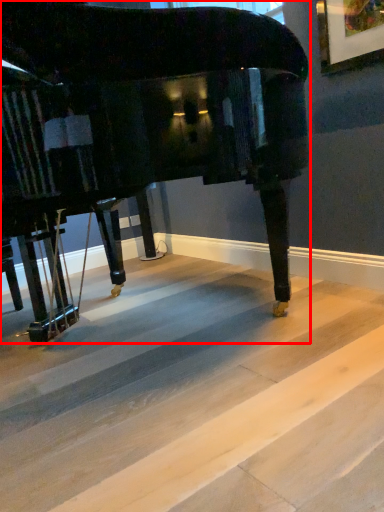
Question: Considering the relative positions of piano (annotated by the red box) and concrete in the image provided, where is piano (annotated by the red box) located with respect to the staircase?

Choices:
 (A) left
 (B) right

Answer: (A)